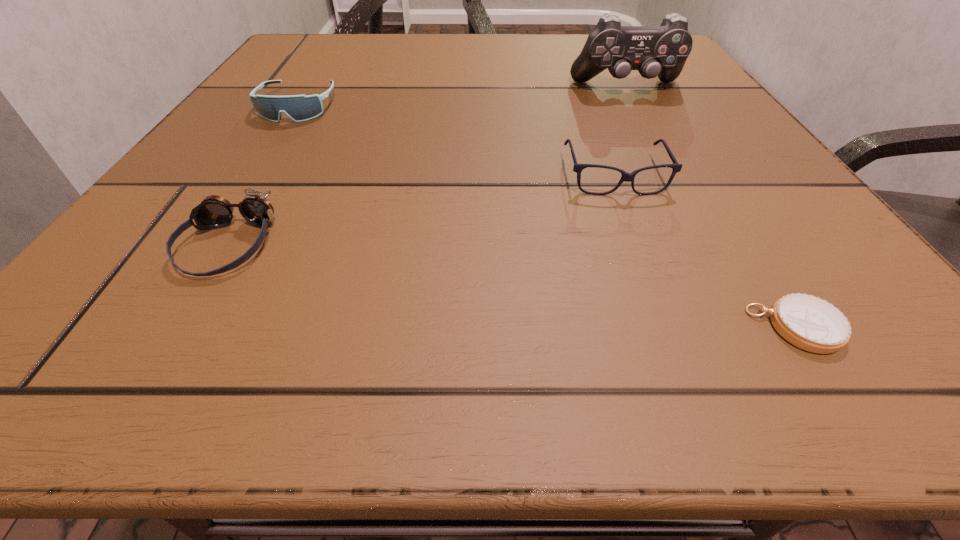
I want to click on the closest object to the fourth farthest object, so click(300, 108).

You are a GUI agent. You are given a task and a screenshot of the screen. Output one action in this format:
    pyautogui.click(x=<x>, y=<y>)
    Task: Click on the vacant space that satisfies the following two spatial constraints: 1. on the front-facing side of the third farthest object; 2. on the left side of the shortest object
    This screenshot has height=540, width=960.
    Given the screenshot: What is the action you would take?
    pyautogui.click(x=672, y=327)

Where is `free location that satisfies the following two spatial constraints: 1. through the lenses of the compass; 2. on the right side of the nearer goggles`? Image resolution: width=960 pixels, height=540 pixels. free location that satisfies the following two spatial constraints: 1. through the lenses of the compass; 2. on the right side of the nearer goggles is located at coordinates (178, 327).